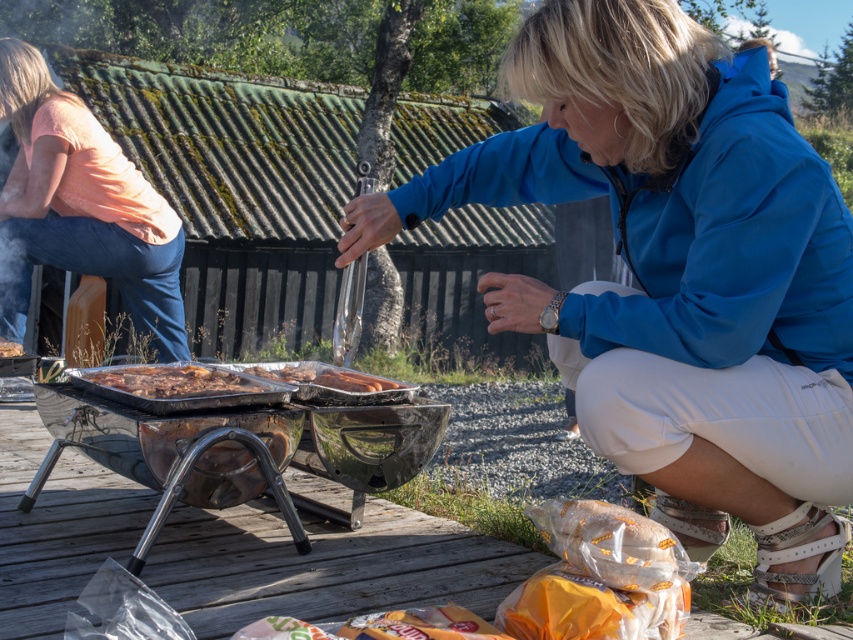
You are planning to place a small sauce bottle on the wooden deck near the grill. The sauce bottle requires a spot that is not occupied by any object listed in the scene. Based on the coordinates provided, can you confirm if the area at point 0.597, 0.416 is free of the slightly charred aluminum foil at center?

The area at point (354, 381) is exactly where the slightly charred aluminum foil at center is located, so it is not free of the object.

You are standing at the barbecue grill and need to reach both the packaged food items and the grilled meats. The packaged food items are located at point (679, 461) and the grilled meats are at point (117, 369). Which location should you move towards first to reach the packaged food items before the grilled meats?

You should move towards point (679, 461) first because it is in front of point (117, 369), meaning it is closer to your current position at the grill.

You are a delivery person who needs to place a small package between the blue fabric jacket at center and the shiny metallic tray at center. Is there enough space to fit the package?

The blue fabric jacket at center and shiny metallic tray at center are 1.04 meters apart from each other, so yes, there is enough space to fit the package between them.